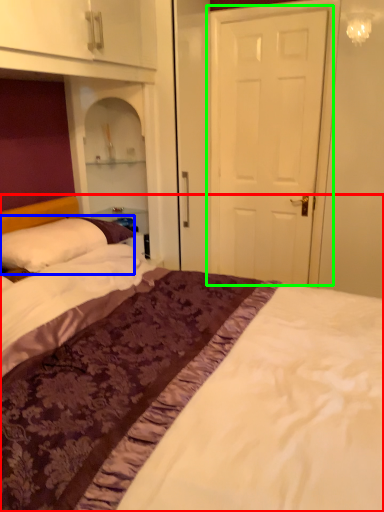
Question: Which object is the farthest from bed (highlighted by a red box)? Choose among these: pillow (highlighted by a blue box) or door (highlighted by a green box).

Choices:
 (A) pillow
 (B) door

Answer: (B)